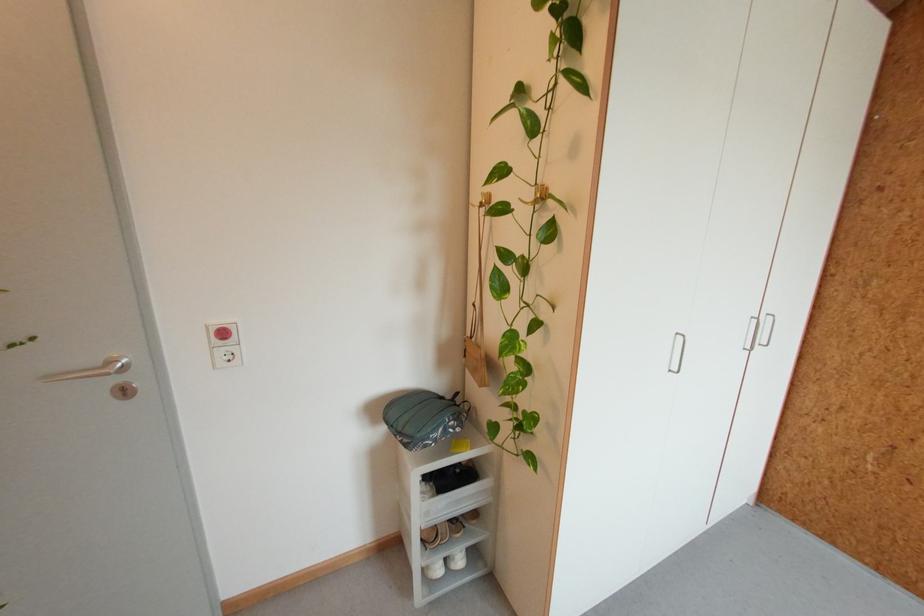
The height and width of the screenshot is (616, 924). Identify the location of white power socket. pyautogui.click(x=225, y=357).